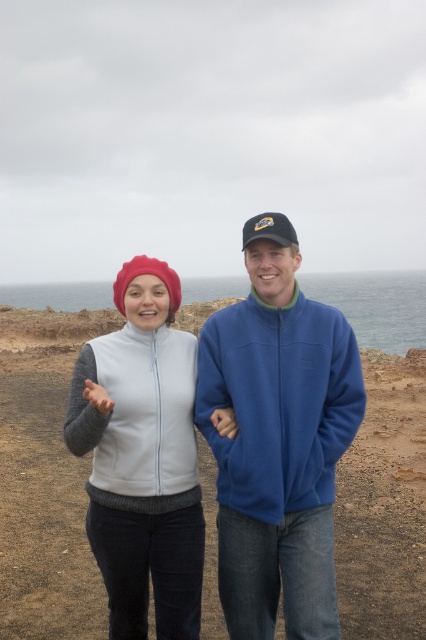
Question: Among these points, which one is nearest to the camera?

Choices:
 (A) (11, 545)
 (B) (126, 461)
 (C) (150, 572)

Answer: (B)

Question: Can you confirm if smooth sand at center is wider than blue fleece jacket at center?

Choices:
 (A) yes
 (B) no

Answer: (A)

Question: Which point appears farthest from the camera in this image?

Choices:
 (A) (149, 509)
 (B) (276, 496)

Answer: (A)

Question: Which object is closer to the camera taking this photo?

Choices:
 (A) matte white vest at center
 (B) white fleece vest at center
 (C) smooth sand at center

Answer: (A)

Question: Is smooth sand at center to the left of blue fleece jacket at center from the viewer's perspective?

Choices:
 (A) no
 (B) yes

Answer: (B)

Question: Can you confirm if matte white vest at center is smaller than white fleece vest at center?

Choices:
 (A) yes
 (B) no

Answer: (B)